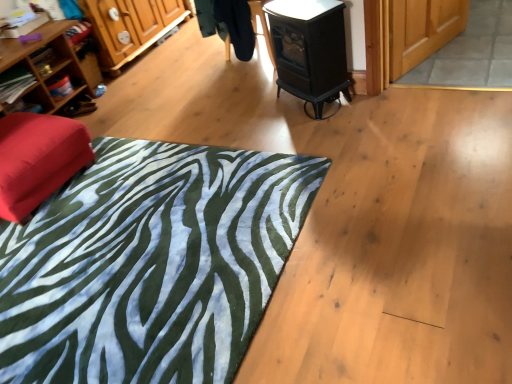
Question: Is green zebra-patterned rug at lower left bigger or smaller than wooden bookshelf at left, positioned as the first shelf in top-to-bottom order?

Choices:
 (A) small
 (B) big

Answer: (A)

Question: Is green zebra-patterned rug at lower left wider or thinner than wooden bookshelf at left, positioned as the first shelf in top-to-bottom order?

Choices:
 (A) wide
 (B) thin

Answer: (A)

Question: Estimate the real-world distances between objects in this image. Which object is closer to the wooden cabinet at left?

Choices:
 (A) matte red ottoman at left
 (B) green zebra-patterned rug at lower left
 (C) wooden shelf at left, the 3th shelf from the top
 (D) wooden shelf at left, arranged as the 2th shelf when ordered from the bottom
 (E) black glossy stove at upper center

Answer: (D)

Question: Based on their relative distances, which object is farther from the matte wooden screen door at upper right?

Choices:
 (A) wooden bookshelf at left, positioned as the first shelf in top-to-bottom order
 (B) wooden shelf at left, the 2th shelf positioned from the top
 (C) black glossy stove at upper center
 (D) wooden cabinet at left
 (E) matte red ottoman at left

Answer: (B)